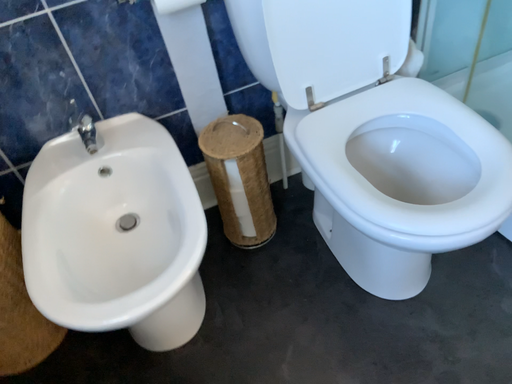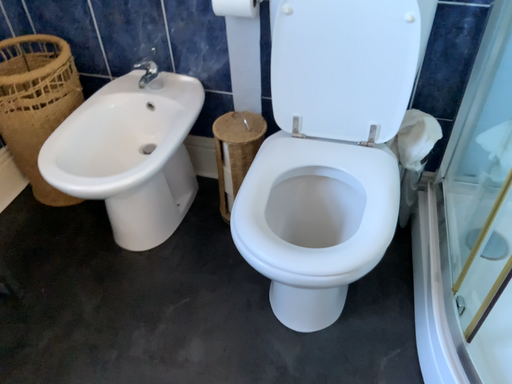
Question: How did the camera likely rotate when shooting the video?

Choices:
 (A) rotated left
 (B) rotated right

Answer: (A)